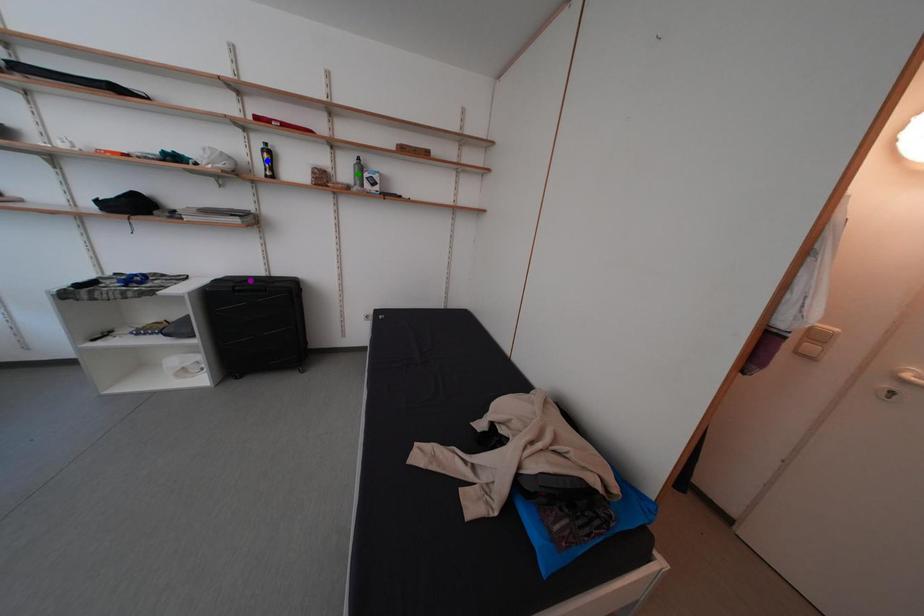
Order these from nearest to farthest:
1. green point
2. purple point
3. blue point

blue point → purple point → green point